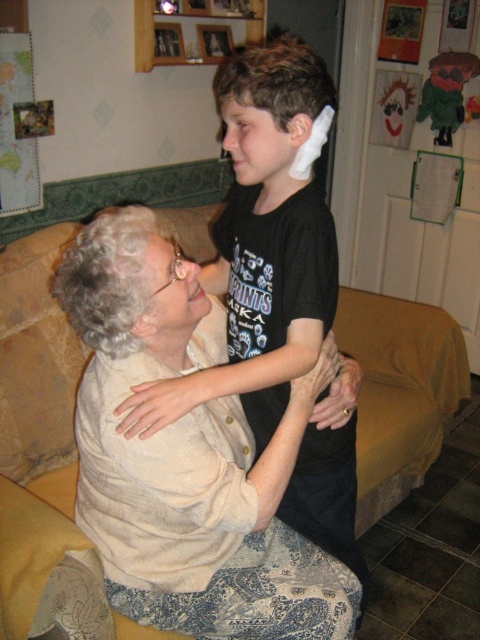
You are designing a new interior layout for this living room. The light beige fabric at center and the black matte shirt at upper center are two key elements. Which object has a greater width?

The light beige fabric at center has a greater width than the black matte shirt at upper center.